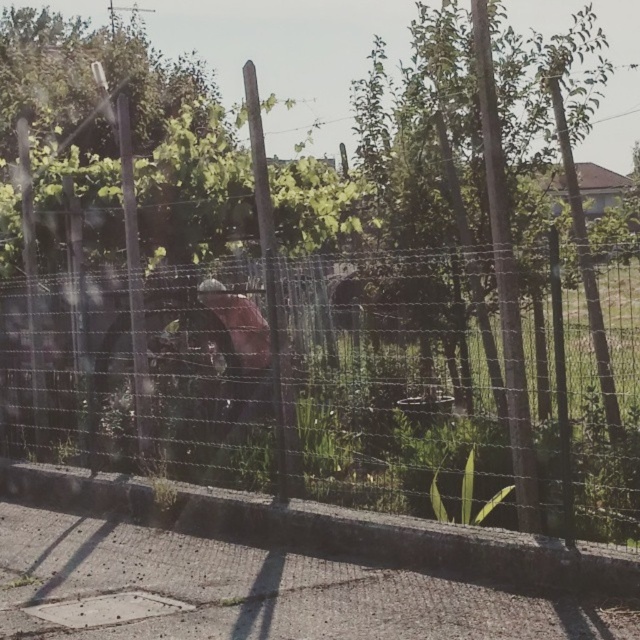
Question: From the image, what is the correct spatial relationship of wire mesh fence at center in relation to green leafy tree at center?

Choices:
 (A) below
 (B) above

Answer: (A)

Question: Can you confirm if wire mesh fence at center is positioned to the left of green leafy tree at center?

Choices:
 (A) no
 (B) yes

Answer: (B)

Question: Does wire mesh fence at center have a smaller size compared to green leafy tree at center?

Choices:
 (A) no
 (B) yes

Answer: (A)

Question: Which point is closer to the camera taking this photo?

Choices:
 (A) (264, 428)
 (B) (490, 275)

Answer: (B)